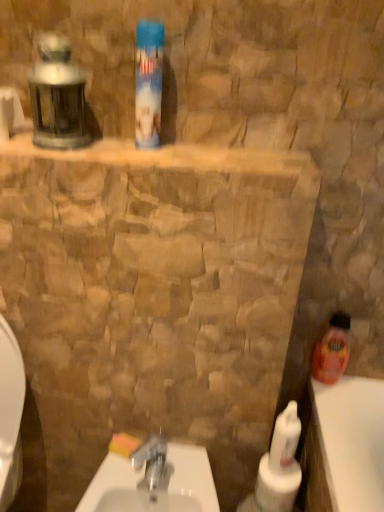
Question: Is point (140, 470) positioned closer to the camera than point (152, 129)?

Choices:
 (A) farther
 (B) closer

Answer: (A)

Question: Based on their sizes in the image, would you say white glossy sink at center is bigger or smaller than blue plastic can at upper center, the 1th cleaning product from the top?

Choices:
 (A) big
 (B) small

Answer: (A)

Question: Estimate the real-world distances between objects in this image. Which object is farther from the yellow sponge at lower center?

Choices:
 (A) blue plastic can at upper center, arranged as the 3th cleaning product when viewed from the back
 (B) translucent plastic bottle at right, the first cleaning product in the right-to-left sequence
 (C) white glossy bottle at lower right, the third cleaning product in the top-to-bottom sequence
 (D) white glossy sink at center

Answer: (A)

Question: Based on their relative distances, which object is farther from the blue plastic can at upper center, which is counted as the 3th cleaning product, starting from the right?

Choices:
 (A) white glossy sink at center
 (B) yellow sponge at lower center
 (C) translucent plastic bottle at right, the 1th cleaning product in the back-to-front sequence
 (D) white glossy bottle at lower right, the second cleaning product positioned from the left

Answer: (B)